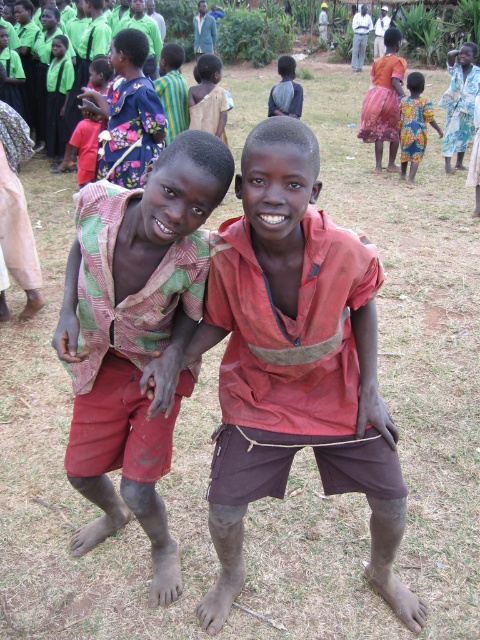
You are a photographer trying to capture a closeup shot of the red matte shirt at center and the multicolored fabric vest at center. Given that your camera can only focus on objects within 10 inches of each other, will you be able to get a clear photo of both items at the same time?

The distance between the red matte shirt at center and the multicolored fabric vest at center is 11.22 inches, which is greater than the camera focus range of 10 inches. Therefore, you cannot capture both items clearly in the same photo.

You are organizing a clothing donation drive and need to categorize items by size. You have a multicolored fabric vest at center and a vibrant floral dress at upper right. Which item is bigger in size?

The multicolored fabric vest at center is larger in size compared to the vibrant floral dress at upper right.